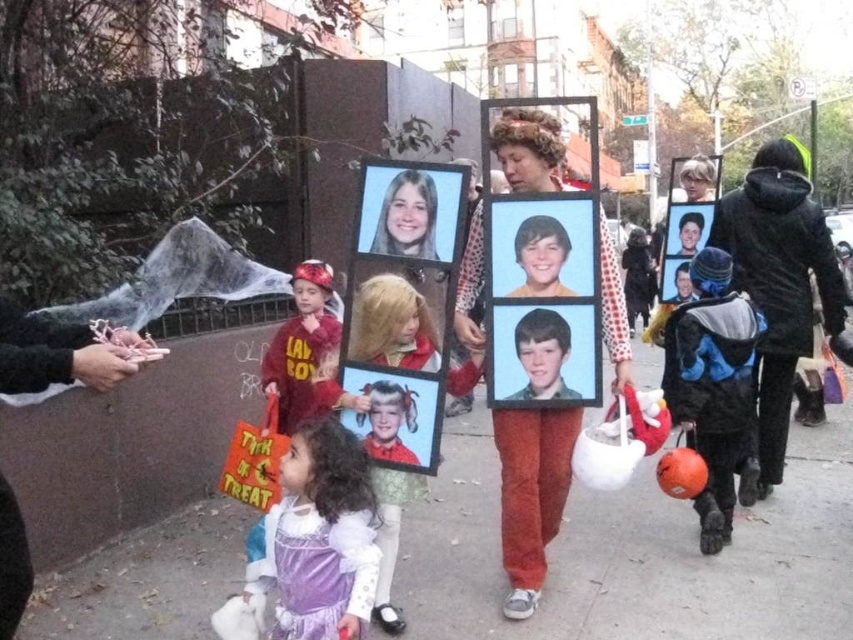
Does gray concrete sidewalk at center have a greater width compared to smooth skin portrait at center?

Indeed, gray concrete sidewalk at center has a greater width compared to smooth skin portrait at center.

Is gray concrete sidewalk at center in front of smooth skin portrait at center?

Yes, it is.

The height and width of the screenshot is (640, 853). What are the coordinates of `gray concrete sidewalk at center` in the screenshot? It's located at [636, 554].

Does matte plastic picture frame at center lie behind smooth skin portrait at center?

No.

Is point (376, 593) positioned before point (389, 220)?

No.

Identify the location of matte plastic picture frame at center. (392, 538).

Is gray concrete sidewalk at center closer to camera compared to velvet purple dress at lower center?

No, gray concrete sidewalk at center is further to the viewer.

Between gray concrete sidewalk at center and velvet purple dress at lower center, which one appears on the right side from the viewer's perspective?

gray concrete sidewalk at center

Identify the location of gray concrete sidewalk at center. This screenshot has width=853, height=640. (636, 554).

In order to click on gray concrete sidewalk at center in this screenshot , I will do `click(636, 554)`.